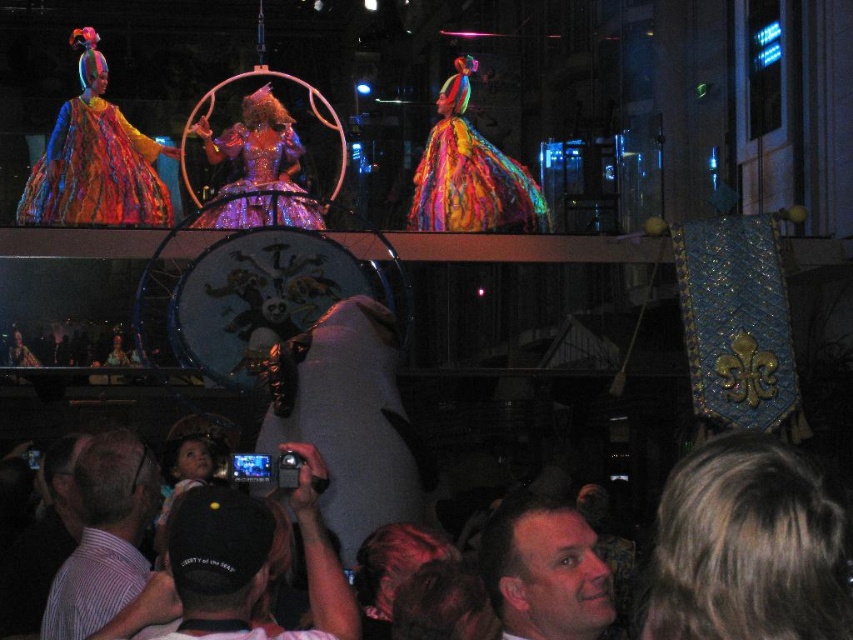
Question: Which point appears closest to the camera in this image?

Choices:
 (A) (136, 492)
 (B) (502, 516)
 (C) (184, 467)

Answer: (B)

Question: Which of the following is the closest to the observer?

Choices:
 (A) click(175, 472)
 (B) click(352, 614)

Answer: (B)

Question: Can you confirm if multicolored sequined dress at center is positioned below soft white fabric baby at lower left?

Choices:
 (A) no
 (B) yes

Answer: (A)

Question: Does blonde hair at lower right come behind shiny sequined dress at center?

Choices:
 (A) yes
 (B) no

Answer: (B)

Question: Which of the following is the farthest from the observer?

Choices:
 (A) (82, 536)
 (B) (106, 204)
 (C) (538, 602)

Answer: (B)

Question: Is blonde hair at lower right closer to the viewer compared to smooth skin face at center?

Choices:
 (A) no
 (B) yes

Answer: (B)